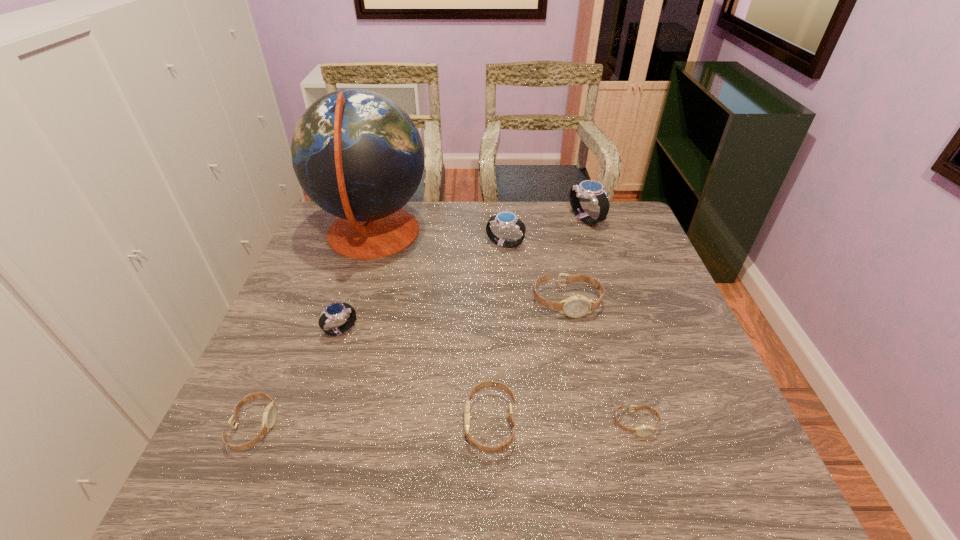
In the image, there is a desktop. Identify the location of free space at the near edge. Image resolution: width=960 pixels, height=540 pixels. (536, 492).

In the image, there is a desktop. What are the coordinates of `vacant area at the left edge` in the screenshot? It's located at (301, 421).

The width and height of the screenshot is (960, 540). In order to click on vacant space at the right edge in this screenshot , I will do `click(691, 363)`.

Where is `empty space between the leftmost watch and the rightmost silver watch`? This screenshot has height=540, width=960. empty space between the leftmost watch and the rightmost silver watch is located at coordinates (420, 323).

Find the location of a particular element. vacant area that lies between the second shortest object and the shortest watch is located at coordinates (444, 426).

You are a GUI agent. You are given a task and a screenshot of the screen. Output one action in this format:
    pyautogui.click(x=<x>, y=<y>)
    Task: Click on the vacant area that lies between the smallest silver watch and the third shortest watch
    The image size is (960, 540).
    Given the screenshot: What is the action you would take?
    pyautogui.click(x=416, y=376)

Image resolution: width=960 pixels, height=540 pixels. Identify the location of blank region between the second farthest silver watch and the shortest watch. (570, 334).

You are a GUI agent. You are given a task and a screenshot of the screen. Output one action in this format:
    pyautogui.click(x=<x>, y=<y>)
    Task: Click on the vacant region between the biggest silver watch and the smallest beige watch
    Image resolution: width=960 pixels, height=540 pixels.
    Given the screenshot: What is the action you would take?
    pyautogui.click(x=611, y=321)

You are a GUI agent. You are given a task and a screenshot of the screen. Output one action in this format:
    pyautogui.click(x=<x>, y=<y>)
    Task: Click on the free space that is in between the fifth nearest watch and the second biggest beige watch
    
    Given the screenshot: What is the action you would take?
    pyautogui.click(x=528, y=362)

In order to click on vacant area that lies between the leftmost watch and the third farthest watch in this screenshot , I will do `click(411, 364)`.